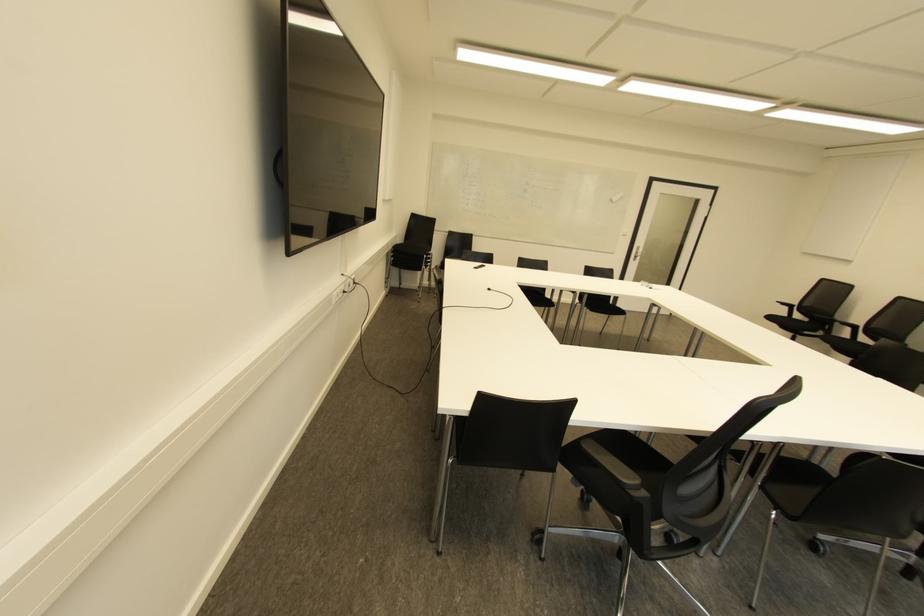
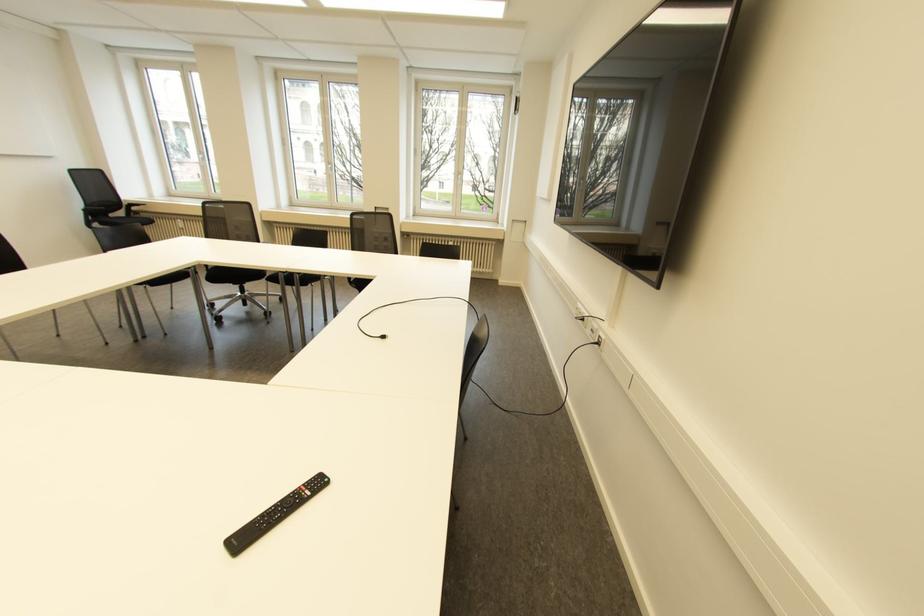
The point at [354,282] is marked in the first image. Where is the corresponding point in the second image?

(598, 342)